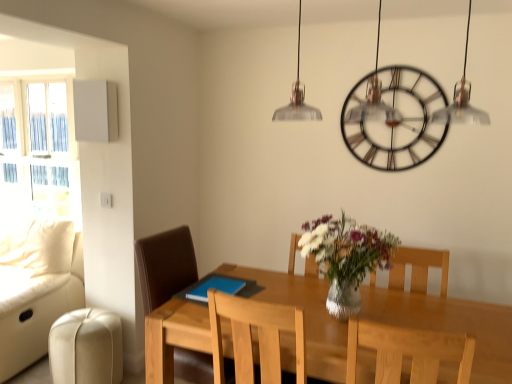
Question: Is metallic/brass-toned clock at upper center outside beige leather swivel chair at lower left?

Choices:
 (A) no
 (B) yes

Answer: (B)

Question: Can you confirm if metallic/brass-toned clock at upper center is thinner than beige leather swivel chair at lower left?

Choices:
 (A) yes
 (B) no

Answer: (A)

Question: Are metallic/brass-toned clock at upper center and beige leather swivel chair at lower left beside each other?

Choices:
 (A) no
 (B) yes

Answer: (A)

Question: Is beige leather swivel chair at lower left surrounded by metallic/brass-toned clock at upper center?

Choices:
 (A) no
 (B) yes

Answer: (A)

Question: From the image's perspective, is metallic/brass-toned clock at upper center above beige leather swivel chair at lower left?

Choices:
 (A) no
 (B) yes

Answer: (B)

Question: Considering their positions, is white glass window at left located in front of or behind light wood chair at center, the 2th chair viewed from the left?

Choices:
 (A) front
 (B) behind

Answer: (B)

Question: In terms of size, does white glass window at left appear bigger or smaller than light wood chair at center, the 1th chair viewed from the right?

Choices:
 (A) small
 (B) big

Answer: (B)

Question: From their relative heights in the image, would you say white glass window at left is taller or shorter than light wood chair at center, the first chair viewed from the front?

Choices:
 (A) short
 (B) tall

Answer: (B)

Question: Is point (5, 119) positioned closer to the camera than point (368, 329)?

Choices:
 (A) closer
 (B) farther

Answer: (B)

Question: Relative to metallic/brass-toned clock at upper center, is light wood table at center in front or behind?

Choices:
 (A) front
 (B) behind

Answer: (A)

Question: From the image's perspective, is light wood table at center positioned above or below metallic/brass-toned clock at upper center?

Choices:
 (A) below
 (B) above

Answer: (A)

Question: From a real-world perspective, relative to metallic/brass-toned clock at upper center, is light wood table at center vertically above or below?

Choices:
 (A) above
 (B) below

Answer: (B)

Question: In terms of width, does light wood table at center look wider or thinner when compared to metallic/brass-toned clock at upper center?

Choices:
 (A) wide
 (B) thin

Answer: (A)

Question: Looking at their shapes, would you say brown leather chair at center, the second chair from the right, is wider or thinner than white glass window at left?

Choices:
 (A) thin
 (B) wide

Answer: (B)

Question: Does point (144, 278) appear closer or farther from the camera than point (64, 145)?

Choices:
 (A) farther
 (B) closer

Answer: (B)